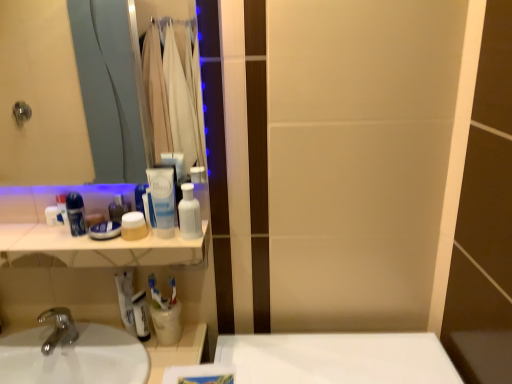
Question: Is blue plastic mouthwash at left, which appears as the 1th mouthwash when viewed from the left, inside or outside of white glossy counter top at upper left?

Choices:
 (A) outside
 (B) inside

Answer: (A)

Question: In terms of width, does blue plastic mouthwash at left, the 7th mouthwash when ordered from right to left, look wider or thinner when compared to white glossy counter top at upper left?

Choices:
 (A) thin
 (B) wide

Answer: (A)

Question: Which object is positioned closest to the silver metallic faucet at lower left?

Choices:
 (A) white plastic deodorant at left
 (B) translucent plastic mouthwash at center, the 2th mouthwash when ordered from right to left
 (C) white glossy counter top at upper left
 (D) blue plastic mouthwash at left, the 7th mouthwash when ordered from right to left
 (E) blue glossy mouthwash at left, the 6th mouthwash when ordered from right to left

Answer: (C)

Question: Considering the real-world distances, which object is closest to the translucent plastic mouthwash at center, acting as the sixth mouthwash starting from the left?

Choices:
 (A) white matte toothpaste at lower left
 (B) white plastic toothbrush at lower center
 (C) white glossy bottle at upper center, the 7th mouthwash viewed from the left
 (D) blue plastic mouthwash at left, which appears as the 1th mouthwash when viewed from the left
 (E) matte beige jar at center, which is counted as the fourth mouthwash, starting from the right

Answer: (C)